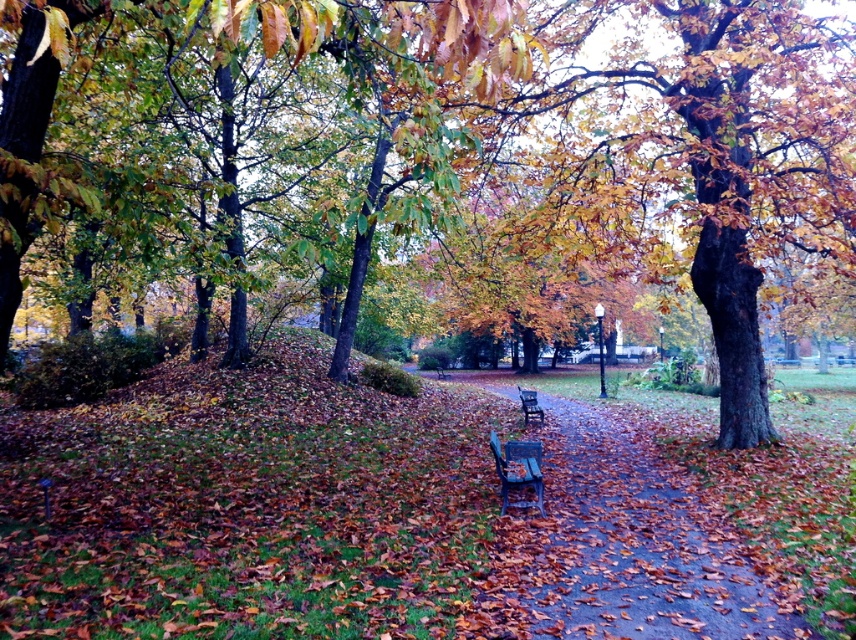
You are a person standing on the dark brown wooden bench at center. You want to walk to the smooth concrete path at center. Is the path accessible from the bench?

The smooth concrete path at center is above the dark brown wooden bench at center, so you can step down from the bench onto the path.

In the scene shown: You are a person with a mobility aid that requires a flat surface. You are standing at the edge of the smooth concrete path at center and want to reach the dark brown wooden bench at center. Can you move directly from the path to the bench without any obstacles?

The smooth concrete path at center has a greater height compared to dark brown wooden bench at center, so you will need to step down from the path to reach the bench. There are no obstacles mentioned in the scene description, so the path is clear.